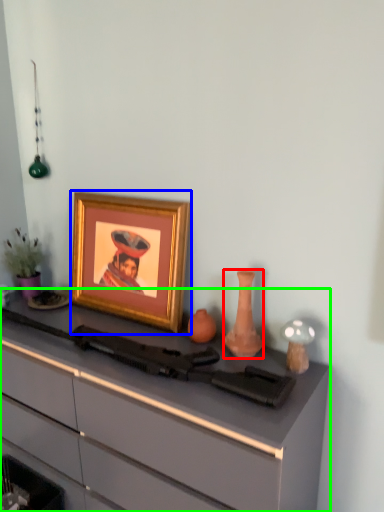
Question: Estimate the real-world distances between objects in this image. Which object is farther from vase (highlighted by a red box), picture frame (highlighted by a blue box) or desk (highlighted by a green box)?

Choices:
 (A) picture frame
 (B) desk

Answer: (B)